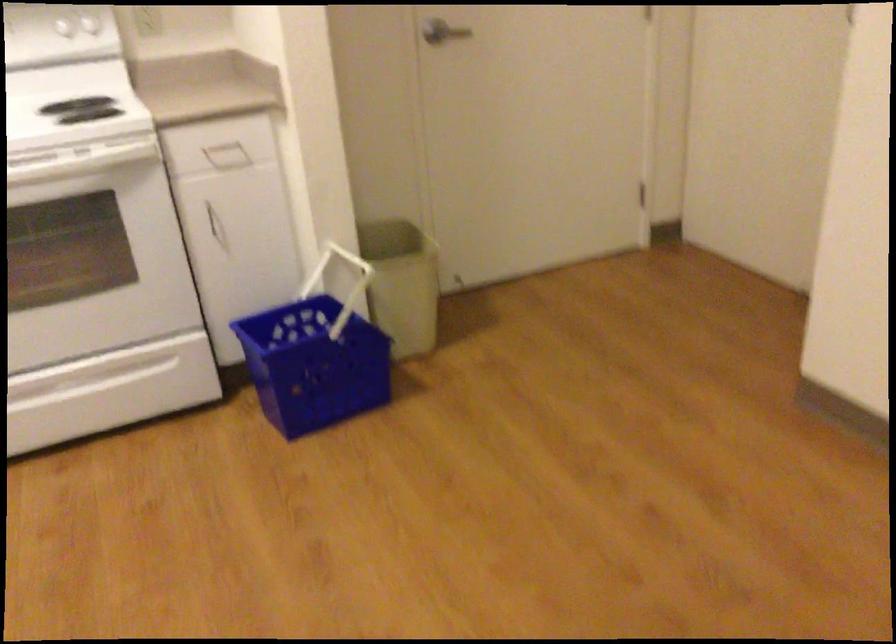
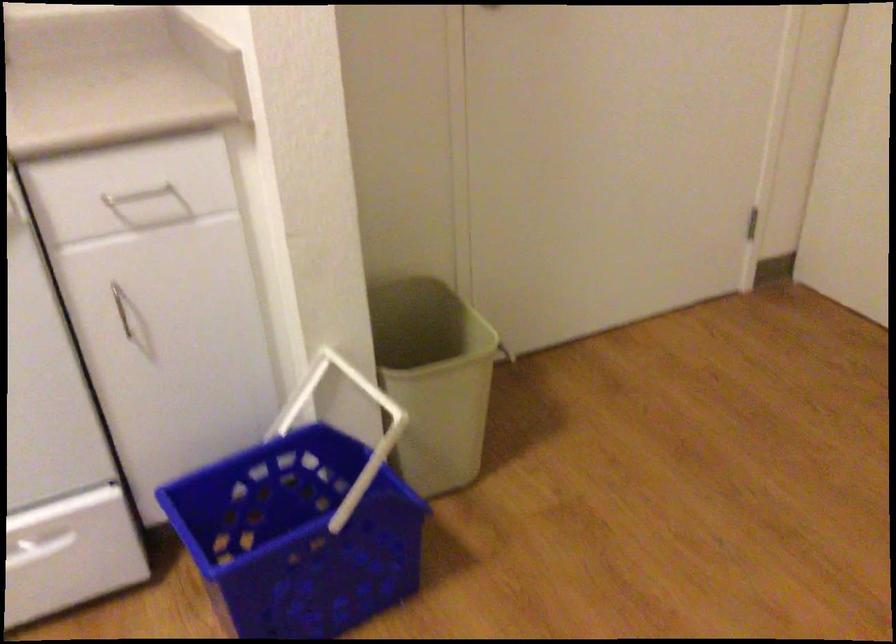
The point at (219, 144) is marked in the first image. Where is the corresponding point in the second image?

(138, 194)